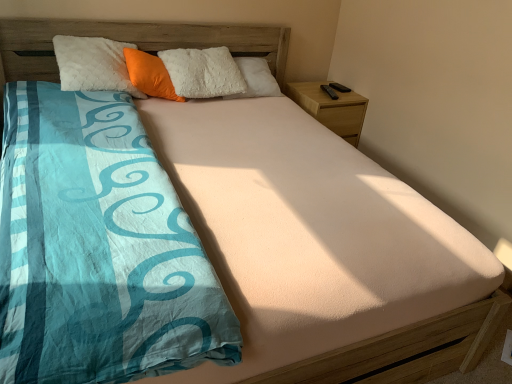
Question: Does wooden nightstand at right contain orange plush pillow at upper center?

Choices:
 (A) no
 (B) yes

Answer: (A)

Question: Considering the relative sizes of wooden nightstand at right and orange plush pillow at upper center in the image provided, is wooden nightstand at right smaller than orange plush pillow at upper center?

Choices:
 (A) no
 (B) yes

Answer: (A)

Question: From the image's perspective, is wooden nightstand at right beneath orange plush pillow at upper center?

Choices:
 (A) yes
 (B) no

Answer: (A)

Question: From the image's perspective, is wooden nightstand at right on top of orange plush pillow at upper center?

Choices:
 (A) no
 (B) yes

Answer: (A)

Question: Considering the relative sizes of wooden nightstand at right and orange plush pillow at upper center in the image provided, is wooden nightstand at right bigger than orange plush pillow at upper center?

Choices:
 (A) no
 (B) yes

Answer: (B)

Question: Is wooden nightstand at right touching orange plush pillow at upper center?

Choices:
 (A) yes
 (B) no

Answer: (B)

Question: From a real-world perspective, is orange plush pillow at upper center located beneath wooden nightstand at right?

Choices:
 (A) no
 (B) yes

Answer: (A)

Question: Could you tell me if orange plush pillow at upper center is turned towards wooden nightstand at right?

Choices:
 (A) no
 (B) yes

Answer: (A)

Question: From a real-world perspective, is orange plush pillow at upper center positioned over wooden nightstand at right based on gravity?

Choices:
 (A) no
 (B) yes

Answer: (B)

Question: Is orange plush pillow at upper center oriented away from wooden nightstand at right?

Choices:
 (A) no
 (B) yes

Answer: (A)

Question: Does orange plush pillow at upper center appear on the right side of wooden nightstand at right?

Choices:
 (A) no
 (B) yes

Answer: (A)

Question: Is orange plush pillow at upper center not inside wooden nightstand at right?

Choices:
 (A) yes
 (B) no

Answer: (A)

Question: From a real-world perspective, relative to orange plush pillow at upper center, is wooden nightstand at right vertically above or below?

Choices:
 (A) above
 (B) below

Answer: (B)